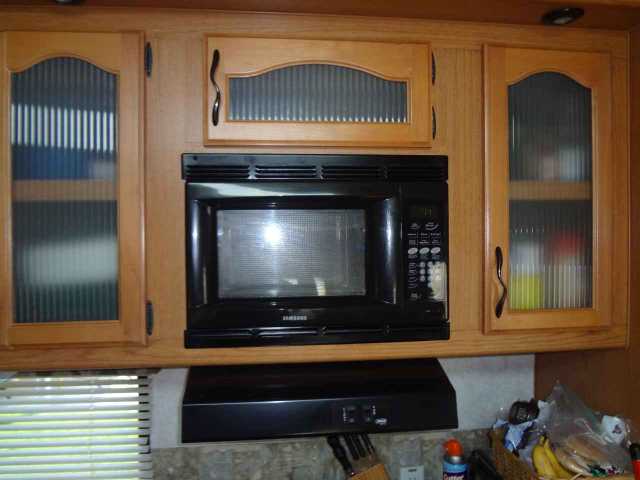
Locate an element on the screen. 1 black stove hood is located at coordinates (299, 409).